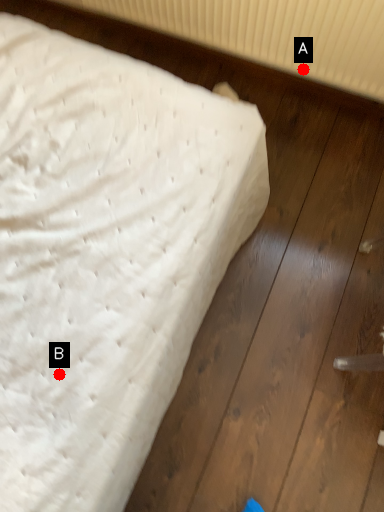
Question: Two points are circled on the image, labeled by A and B beside each circle. Which point is further to the camera?

Choices:
 (A) A is further
 (B) B is further

Answer: (A)